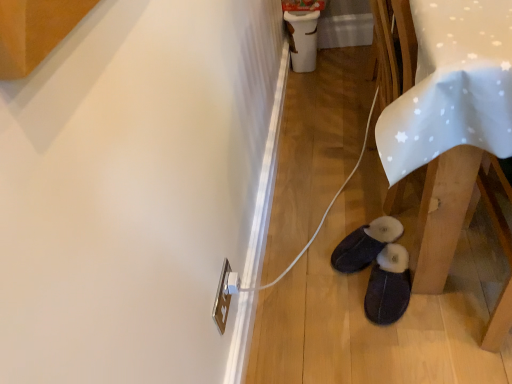
Image resolution: width=512 pixels, height=384 pixels. I want to click on free area in between dark gray suede slippers at lower center, the 1th footwear when ordered from front to back, and dark suede slippers at lower center, which appears as the second footwear when viewed from the front, so click(353, 295).